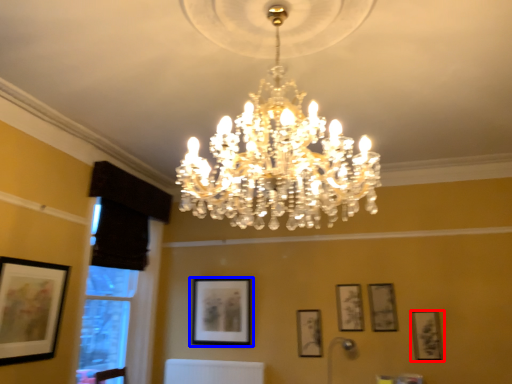
Question: Which of the following is the farthest to the observer, picture frame (highlighted by a red box) or picture frame (highlighted by a blue box)?

Choices:
 (A) picture frame
 (B) picture frame

Answer: (B)